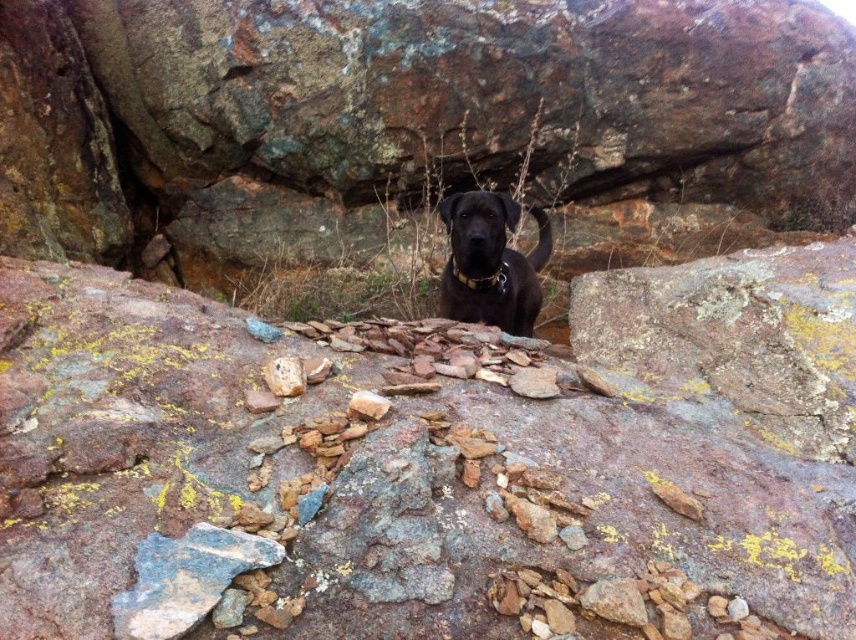
Question: Where is rusty rock at center located in relation to shiny black dog at center in the image?

Choices:
 (A) right
 (B) left

Answer: (A)

Question: Which point is farther from the camera taking this photo?

Choices:
 (A) (520, 275)
 (B) (693, 566)

Answer: (A)

Question: Which object appears farthest from the camera in this image?

Choices:
 (A) shiny black dog at center
 (B) rusty rock at center

Answer: (A)

Question: Is rusty rock at center in front of shiny black dog at center?

Choices:
 (A) no
 (B) yes

Answer: (B)

Question: Which object appears closest to the camera in this image?

Choices:
 (A) rusty rock at center
 (B) shiny black dog at center

Answer: (A)

Question: Can you confirm if rusty rock at center is positioned to the left of shiny black dog at center?

Choices:
 (A) no
 (B) yes

Answer: (A)